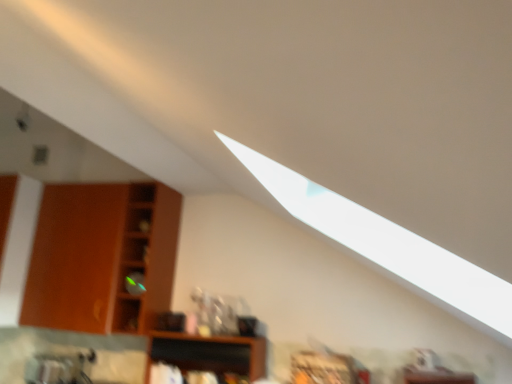
Image resolution: width=512 pixels, height=384 pixels. What are the coordinates of `wooden at center, marked as the 1th shelf in a bottom-to-top arrangement` in the screenshot? It's located at (210, 353).

This screenshot has width=512, height=384. What do you see at coordinates (210, 353) in the screenshot?
I see `wooden at center, placed as the 2th shelf when sorted from left to right` at bounding box center [210, 353].

In the scene shown: How much space does wooden cabinet at left, placed as the 1th shelf when sorted from top to bottom, occupy vertically?

33.45 inches.

Locate an element on the screen. The image size is (512, 384). wooden cabinet at left, placed as the 1th shelf when sorted from top to bottom is located at coordinates [102, 257].

Describe the element at coordinates (102, 257) in the screenshot. This screenshot has width=512, height=384. I see `wooden cabinet at left, which appears as the first shelf when viewed from the left` at that location.

At what (x,y) coordinates should I click in order to perform the action: click on wooden at center, the 1th shelf when ordered from right to left. Please return your answer as a coordinate pair (x, y). Looking at the image, I should click on (210, 353).

Would you say wooden at center, the second shelf positioned from the top, is to the left or to the right of wooden cabinet at left, placed as the 1th shelf when sorted from top to bottom, in the picture?

Based on their positions, wooden at center, the second shelf positioned from the top, is located to the right of wooden cabinet at left, placed as the 1th shelf when sorted from top to bottom.

Does wooden at center, placed as the 2th shelf when sorted from left to right, lie in front of wooden cabinet at left, which appears as the first shelf when viewed from the left?

Yes, wooden at center, placed as the 2th shelf when sorted from left to right, is closer to the viewer.

Is point (198, 348) positioned in front of point (110, 321)?

No, (198, 348) is behind (110, 321).

From the picture: From the image's perspective, between wooden at center, placed as the 2th shelf when sorted from left to right, and wooden cabinet at left, which ranks as the second shelf in right-to-left order, which one is located above?

From the image's view, wooden cabinet at left, which ranks as the second shelf in right-to-left order, is above.

From a real-world perspective, is wooden at center, the 1th shelf when ordered from right to left, physically located above or below wooden cabinet at left, which appears as the first shelf when viewed from the left?

wooden at center, the 1th shelf when ordered from right to left, is situated lower than wooden cabinet at left, which appears as the first shelf when viewed from the left, in the real world.

Does wooden at center, marked as the 1th shelf in a bottom-to-top arrangement, have a greater width compared to wooden cabinet at left, placed as the 1th shelf when sorted from top to bottom?

No, wooden at center, marked as the 1th shelf in a bottom-to-top arrangement, is not wider than wooden cabinet at left, placed as the 1th shelf when sorted from top to bottom.

Does wooden at center, the 1th shelf when ordered from right to left, have a greater height compared to wooden cabinet at left, placed as the 1th shelf when sorted from top to bottom?

No, wooden at center, the 1th shelf when ordered from right to left, is not taller than wooden cabinet at left, placed as the 1th shelf when sorted from top to bottom.

Which of these two, wooden at center, placed as the 2th shelf when sorted from left to right, or wooden cabinet at left, placed as the 1th shelf when sorted from top to bottom, is bigger?

wooden cabinet at left, placed as the 1th shelf when sorted from top to bottom.

Is wooden at center, the 1th shelf when ordered from right to left, located outside wooden cabinet at left, placed as the 1th shelf when sorted from top to bottom?

Indeed, wooden at center, the 1th shelf when ordered from right to left, is completely outside wooden cabinet at left, placed as the 1th shelf when sorted from top to bottom.

Would you say wooden at center, placed as the 2th shelf when sorted from left to right, is a long distance from wooden cabinet at left, which appears as the second shelf when ordered from the bottom?

No.

Is wooden at center, the second shelf positioned from the top, facing towards wooden cabinet at left, which appears as the first shelf when viewed from the left?

No, wooden at center, the second shelf positioned from the top, is not turned towards wooden cabinet at left, which appears as the first shelf when viewed from the left.

Consider the image. How different are the orientations of wooden at center, marked as the 1th shelf in a bottom-to-top arrangement, and wooden cabinet at left, which appears as the first shelf when viewed from the left, in degrees?

There is a 0.000231-degree angle between the facing directions of wooden at center, marked as the 1th shelf in a bottom-to-top arrangement, and wooden cabinet at left, which appears as the first shelf when viewed from the left.

How distant is wooden at center, the 1th shelf when ordered from right to left, from wooden cabinet at left, which appears as the second shelf when ordered from the bottom?

wooden at center, the 1th shelf when ordered from right to left, is 52.65 centimeters away from wooden cabinet at left, which appears as the second shelf when ordered from the bottom.

Locate an element on the screen. Image resolution: width=512 pixels, height=384 pixels. shelf positioned vertically above the wooden at center, marked as the 1th shelf in a bottom-to-top arrangement (from a real-world perspective) is located at coordinates (102, 257).

Which object is positioned more to the left, wooden cabinet at left, placed as the 1th shelf when sorted from top to bottom, or wooden at center, the second shelf positioned from the top?

wooden cabinet at left, placed as the 1th shelf when sorted from top to bottom.

From the picture: Is the position of wooden cabinet at left, which appears as the first shelf when viewed from the left, more distant than that of wooden at center, the 1th shelf when ordered from right to left?

That is True.

Is point (158, 216) positioned in front of point (245, 374)?

No, it is not.

From the image's perspective, is wooden cabinet at left, placed as the 1th shelf when sorted from top to bottom, under wooden at center, marked as the 1th shelf in a bottom-to-top arrangement?

No, from the image's perspective, wooden cabinet at left, placed as the 1th shelf when sorted from top to bottom, is not beneath wooden at center, marked as the 1th shelf in a bottom-to-top arrangement.

From a real-world perspective, is wooden cabinet at left, which ranks as the second shelf in right-to-left order, under wooden at center, the second shelf positioned from the top?

Incorrect, from a real-world perspective, wooden cabinet at left, which ranks as the second shelf in right-to-left order, is higher than wooden at center, the second shelf positioned from the top.

Which object is thinner, wooden cabinet at left, which appears as the first shelf when viewed from the left, or wooden at center, placed as the 2th shelf when sorted from left to right?

With smaller width is wooden at center, placed as the 2th shelf when sorted from left to right.

Between wooden cabinet at left, placed as the 1th shelf when sorted from top to bottom, and wooden at center, the second shelf positioned from the top, which one has more height?

With more height is wooden cabinet at left, placed as the 1th shelf when sorted from top to bottom.

Between wooden cabinet at left, which appears as the first shelf when viewed from the left, and wooden at center, marked as the 1th shelf in a bottom-to-top arrangement, which one has smaller size?

wooden at center, marked as the 1th shelf in a bottom-to-top arrangement.

Consider the image. Does wooden cabinet at left, which appears as the second shelf when ordered from the bottom, contain wooden at center, placed as the 2th shelf when sorted from left to right?

That's incorrect, wooden at center, placed as the 2th shelf when sorted from left to right, is not inside wooden cabinet at left, which appears as the second shelf when ordered from the bottom.

Are wooden cabinet at left, which appears as the second shelf when ordered from the bottom, and wooden at center, placed as the 2th shelf when sorted from left to right, far apart?

wooden cabinet at left, which appears as the second shelf when ordered from the bottom, is near wooden at center, placed as the 2th shelf when sorted from left to right, not far away.

Is wooden at center, placed as the 2th shelf when sorted from left to right, at the back of wooden cabinet at left, which ranks as the second shelf in right-to-left order?

wooden cabinet at left, which ranks as the second shelf in right-to-left order, does not have its back to wooden at center, placed as the 2th shelf when sorted from left to right.

How many degrees apart are the facing directions of wooden cabinet at left, which ranks as the second shelf in right-to-left order, and wooden at center, placed as the 2th shelf when sorted from left to right?

0.000231 degrees.

The height and width of the screenshot is (384, 512). In order to click on shelf behind the wooden at center, the 1th shelf when ordered from right to left in this screenshot , I will do `click(102, 257)`.

Find the location of `shelf above the wooden at center, marked as the 1th shelf in a bottom-to-top arrangement (from a real-world perspective)`. shelf above the wooden at center, marked as the 1th shelf in a bottom-to-top arrangement (from a real-world perspective) is located at coordinates (102, 257).

Find the location of a particular element. This screenshot has height=384, width=512. shelf located behind the wooden at center, the second shelf positioned from the top is located at coordinates click(102, 257).